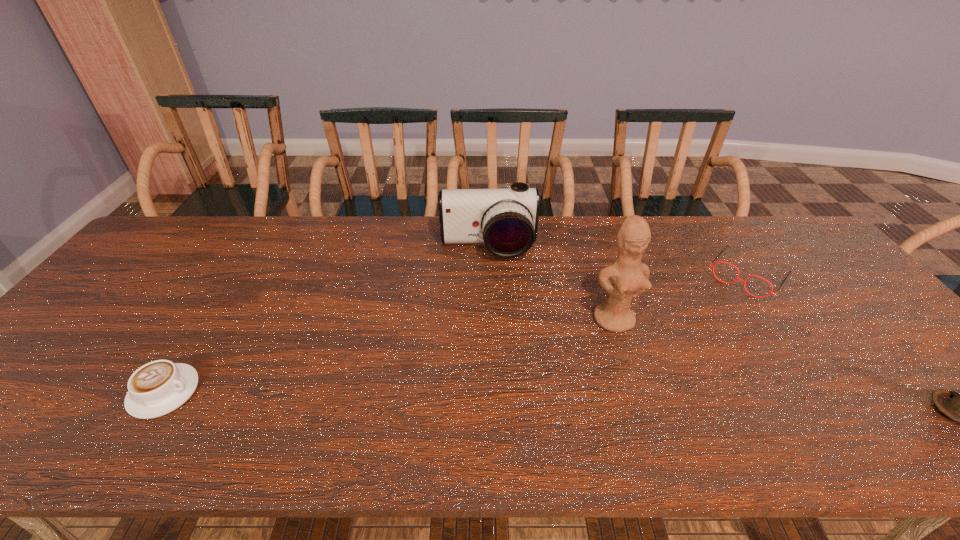
Image resolution: width=960 pixels, height=540 pixels. Find the location of `free location at the far edge`. free location at the far edge is located at coordinates (358, 234).

Find the location of `vacant area at the near edge of the desktop`. vacant area at the near edge of the desktop is located at coordinates (700, 383).

Where is `free space at the left edge of the desktop`? The height and width of the screenshot is (540, 960). free space at the left edge of the desktop is located at coordinates (32, 368).

Find the location of a particular element. The width and height of the screenshot is (960, 540). free point between the figurine and the spectacles is located at coordinates (681, 298).

Where is `vacant region between the figurine and the second object from right to left`? The image size is (960, 540). vacant region between the figurine and the second object from right to left is located at coordinates (681, 298).

This screenshot has height=540, width=960. In order to click on unoccupied position between the figurine and the leftmost object in this screenshot , I will do `click(389, 356)`.

Locate an element on the screen. object that is the closest to the cappuccino is located at coordinates (506, 220).

Select which object appears as the closest to the spectacles. Please provide its 2D coordinates. Your answer should be formatted as a tuple, i.e. [(x, y)], where the tuple contains the x and y coordinates of a point satisfying the conditions above.

[(629, 276)]